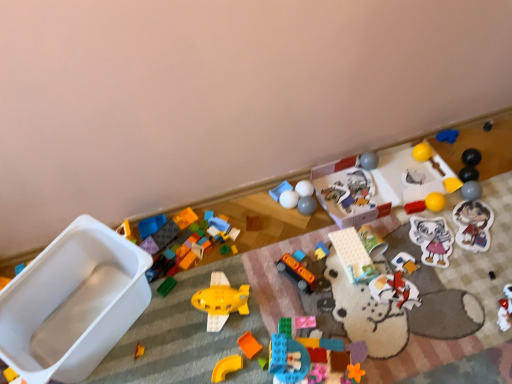
Locate an element on the screen. This screenshot has width=512, height=384. free space to the left of translucent plastic blocks at center, positioned as the 15th toy in right-to-left order is located at coordinates (238, 360).